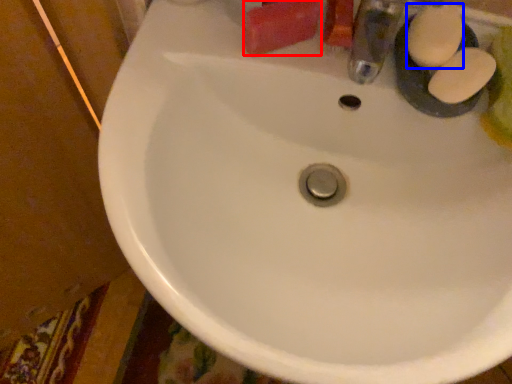
Question: Which object appears farthest to the camera in this image, soap (highlighted by a red box) or soap (highlighted by a blue box)?

Choices:
 (A) soap
 (B) soap

Answer: (A)